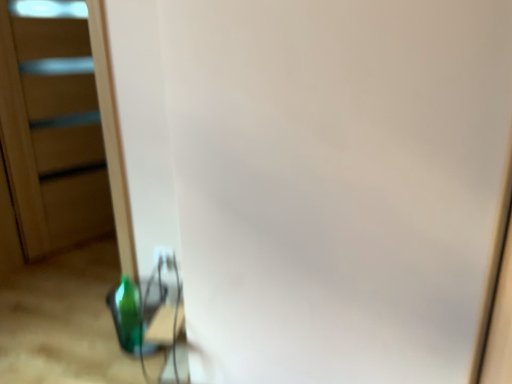
Question: From a real-world perspective, is white plastic electric outlet at lower center over transparent plastic screen door at left?

Choices:
 (A) no
 (B) yes

Answer: (A)

Question: Does white plastic electric outlet at lower center have a lesser width compared to transparent plastic screen door at left?

Choices:
 (A) yes
 (B) no

Answer: (A)

Question: Is white plastic electric outlet at lower center outside of transparent plastic screen door at left?

Choices:
 (A) yes
 (B) no

Answer: (A)

Question: Does white plastic electric outlet at lower center come behind transparent plastic screen door at left?

Choices:
 (A) no
 (B) yes

Answer: (A)

Question: Can you confirm if white plastic electric outlet at lower center is shorter than transparent plastic screen door at left?

Choices:
 (A) yes
 (B) no

Answer: (A)

Question: From a real-world perspective, is green glass bottle at lower left positioned above or below white plastic electric outlet at lower center?

Choices:
 (A) below
 (B) above

Answer: (A)

Question: Looking at the image, does green glass bottle at lower left seem bigger or smaller compared to white plastic electric outlet at lower center?

Choices:
 (A) big
 (B) small

Answer: (A)

Question: Considering the positions of green glass bottle at lower left and white plastic electric outlet at lower center in the image, is green glass bottle at lower left taller or shorter than white plastic electric outlet at lower center?

Choices:
 (A) tall
 (B) short

Answer: (A)

Question: In the image, is green glass bottle at lower left on the left side or the right side of white plastic electric outlet at lower center?

Choices:
 (A) left
 (B) right

Answer: (A)

Question: Considering the positions of point (161, 258) and point (7, 82), is point (161, 258) closer or farther from the camera than point (7, 82)?

Choices:
 (A) closer
 (B) farther

Answer: (A)

Question: In the image, is white plastic electric outlet at lower center positioned in front of or behind transparent plastic screen door at left?

Choices:
 (A) behind
 (B) front

Answer: (B)

Question: In terms of width, does white plastic electric outlet at lower center look wider or thinner when compared to transparent plastic screen door at left?

Choices:
 (A) thin
 (B) wide

Answer: (A)

Question: From a real-world perspective, relative to transparent plastic screen door at left, is white plastic electric outlet at lower center vertically above or below?

Choices:
 (A) above
 (B) below

Answer: (B)

Question: In the image, is white plastic electric outlet at lower center positioned in front of or behind green glass bottle at lower left?

Choices:
 (A) behind
 (B) front

Answer: (A)

Question: Do you think white plastic electric outlet at lower center is within green glass bottle at lower left, or outside of it?

Choices:
 (A) outside
 (B) inside

Answer: (A)